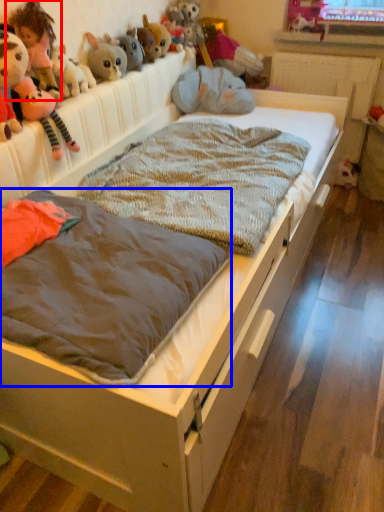
Question: Which of the following is the closest to the observer, toy (highlighted by a red box) or mattress (highlighted by a blue box)?

Choices:
 (A) toy
 (B) mattress

Answer: (B)